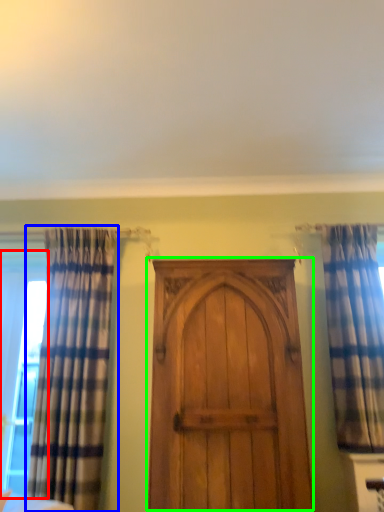
Question: Which object is positioned closest to window (highlighted by a red box)? Select from curtain (highlighted by a blue box) and door (highlighted by a green box).

Choices:
 (A) curtain
 (B) door

Answer: (A)